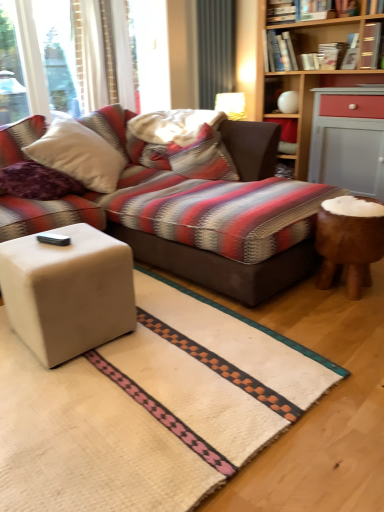
Question: Looking at their shapes, would you say hardcover book at upper center, the 7th book positioned from the right, is wider or thinner than beige matte cube at lower left?

Choices:
 (A) wide
 (B) thin

Answer: (B)

Question: In terms of height, does hardcover book at upper center, the 7th book positioned from the right, look taller or shorter compared to beige matte cube at lower left?

Choices:
 (A) short
 (B) tall

Answer: (A)

Question: Which object is positioned closest to the hardcover book at upper right, arranged as the third book when viewed from the right?

Choices:
 (A) purple soft pillow at left, arranged as the 1th pillow when viewed from the left
 (B) hardcover book at upper right, placed as the 4th book when sorted from left to right
 (C) hardcover book at upper center, positioned as the fifth book in right-to-left order
 (D) striped fabric pillow at center, which is the 1th pillow in back-to-front order
 (E) beige matte cube at lower left

Answer: (B)

Question: Which object is the closest to the purple soft pillow at left, acting as the second pillow starting from the right?

Choices:
 (A) hardcover book at upper center, the 7th book positioned from the right
 (B) hardcover book at upper right, the fourth book viewed from the right
 (C) hardcover book at upper center, which is counted as the 3th book, starting from the left
 (D) wooden stool at right
 (E) striped fabric pillow at center, the first pillow when ordered from right to left

Answer: (E)